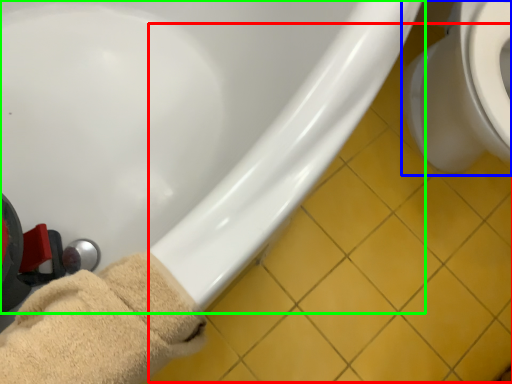
Question: Estimate the real-world distances between objects in this image. Which object is closer to tile (highlighted by a red box), toilet (highlighted by a blue box) or bathtub (highlighted by a green box)?

Choices:
 (A) toilet
 (B) bathtub

Answer: (A)